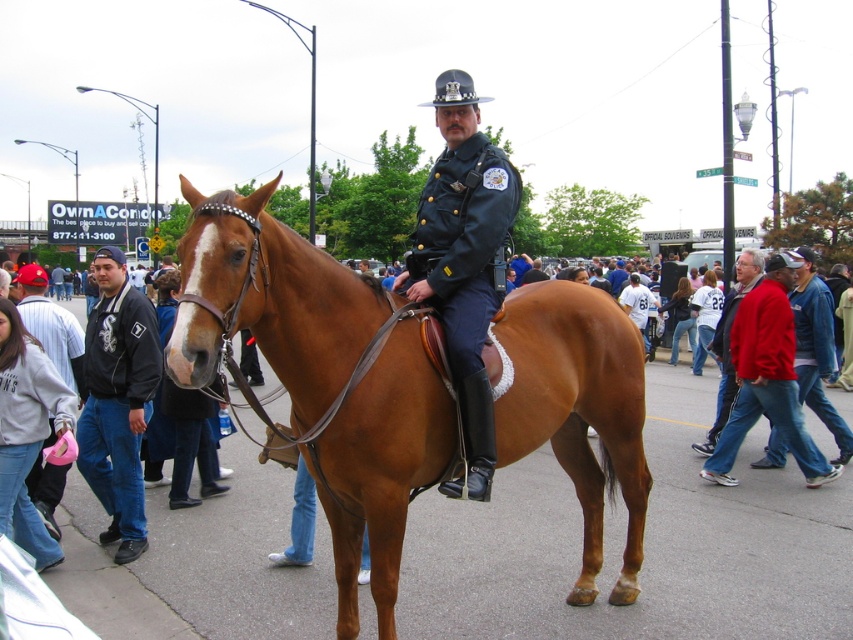
Who is lower down, brown leather horse at center or black leather jacket at left?

Positioned lower is black leather jacket at left.

Who is taller, brown leather horse at center or black leather jacket at left?

brown leather horse at center

At what (x,y) coordinates should I click in order to perform the action: click on brown leather horse at center. Please return your answer as a coordinate pair (x, y). This screenshot has width=853, height=640. Looking at the image, I should click on (318, 376).

In the scene shown: Can you confirm if shiny dark blue uniform at center is positioned below red jacket at center?

Actually, shiny dark blue uniform at center is above red jacket at center.

Between point (438, 173) and point (724, 314), which one is positioned in front?

Point (438, 173) is more forward.

Between point (511, 172) and point (750, 276), which one is positioned behind?

Point (750, 276)

Locate an element on the screen. This screenshot has height=640, width=853. shiny dark blue uniform at center is located at coordinates (463, 260).

Is point (85, 461) farther from viewer compared to point (50, 330)?

No, it is not.

Who is shorter, black leather jacket at left or brushed metal water at bottle left?

Standing shorter between the two is black leather jacket at left.

Who is more distant from viewer, (102,428) or (76,323)?

Point (76,323)

Where is `black leather jacket at left`? The width and height of the screenshot is (853, 640). black leather jacket at left is located at coordinates (117, 401).